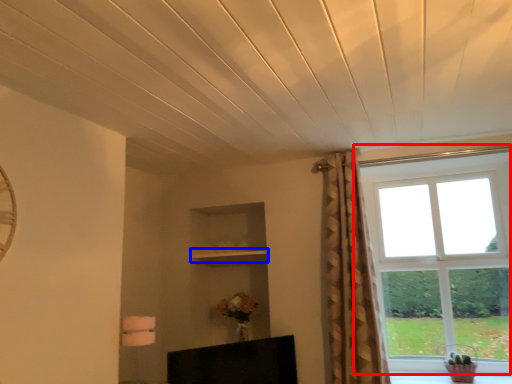
Question: Which of the following is the farthest to the observer, window (highlighted by a red box) or shelf (highlighted by a blue box)?

Choices:
 (A) window
 (B) shelf

Answer: (B)